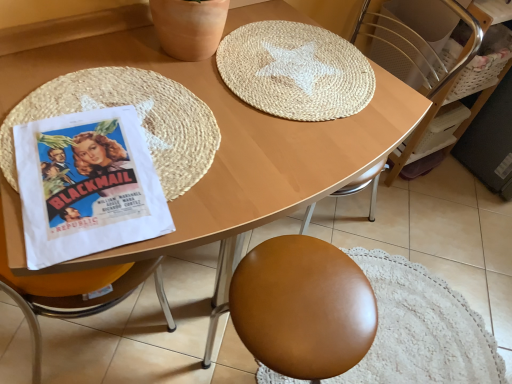
The image size is (512, 384). I want to click on empty space that is ontop of woven straw placemat at left, which ranks as the 2th mat in right-to-left order (from a real-world perspective), so click(119, 129).